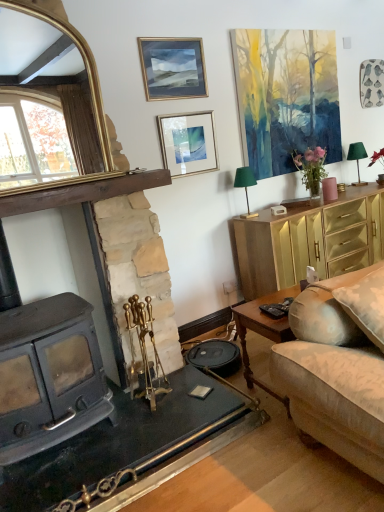
Question: Is gold-framed picture at upper center, marked as the third picture frame in a right-to-left arrangement, facing towards gold/gilded mirror at upper left?

Choices:
 (A) no
 (B) yes

Answer: (A)

Question: From the image's perspective, is gold-framed picture at upper center, marked as the third picture frame in a right-to-left arrangement, located above gold/gilded mirror at upper left?

Choices:
 (A) no
 (B) yes

Answer: (B)

Question: From a real-world perspective, is gold-framed picture at upper center, marked as the third picture frame in a right-to-left arrangement, physically above gold/gilded mirror at upper left?

Choices:
 (A) no
 (B) yes

Answer: (B)

Question: Is gold-framed picture at upper center, which appears as the first picture frame when viewed from the left, facing away from gold/gilded mirror at upper left?

Choices:
 (A) yes
 (B) no

Answer: (B)

Question: From the image's perspective, is gold-framed picture at upper center, marked as the third picture frame in a right-to-left arrangement, beneath gold/gilded mirror at upper left?

Choices:
 (A) yes
 (B) no

Answer: (B)

Question: Does gold-framed picture at upper center, which appears as the first picture frame when viewed from the left, appear on the left side of gold/gilded mirror at upper left?

Choices:
 (A) no
 (B) yes

Answer: (A)

Question: Can you confirm if wooden coffee table at lower right is smaller than black plastic remote control at lower right?

Choices:
 (A) yes
 (B) no

Answer: (B)

Question: Is wooden coffee table at lower right closer to the viewer compared to black plastic remote control at lower right?

Choices:
 (A) yes
 (B) no

Answer: (A)

Question: Is wooden coffee table at lower right placed right next to black plastic remote control at lower right?

Choices:
 (A) no
 (B) yes

Answer: (A)

Question: Considering the relative sizes of wooden coffee table at lower right and black plastic remote control at lower right in the image provided, is wooden coffee table at lower right thinner than black plastic remote control at lower right?

Choices:
 (A) no
 (B) yes

Answer: (A)

Question: Can you confirm if wooden coffee table at lower right is taller than black plastic remote control at lower right?

Choices:
 (A) yes
 (B) no

Answer: (A)

Question: Can you confirm if wooden coffee table at lower right is positioned to the right of black plastic remote control at lower right?

Choices:
 (A) no
 (B) yes

Answer: (B)

Question: Are watercolor painting at upper right, the first picture frame positioned from the right, and green fabric lampshade at upper right, placed as the first lamp when sorted from bottom to top, far apart?

Choices:
 (A) no
 (B) yes

Answer: (A)